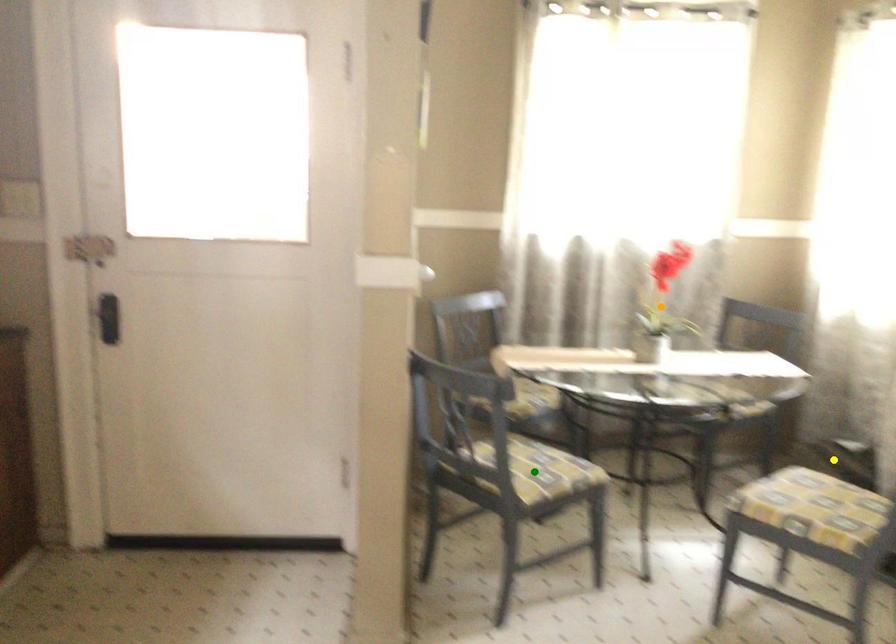
Order these from nearest to farthest:
orange point, green point, yellow point

orange point → yellow point → green point